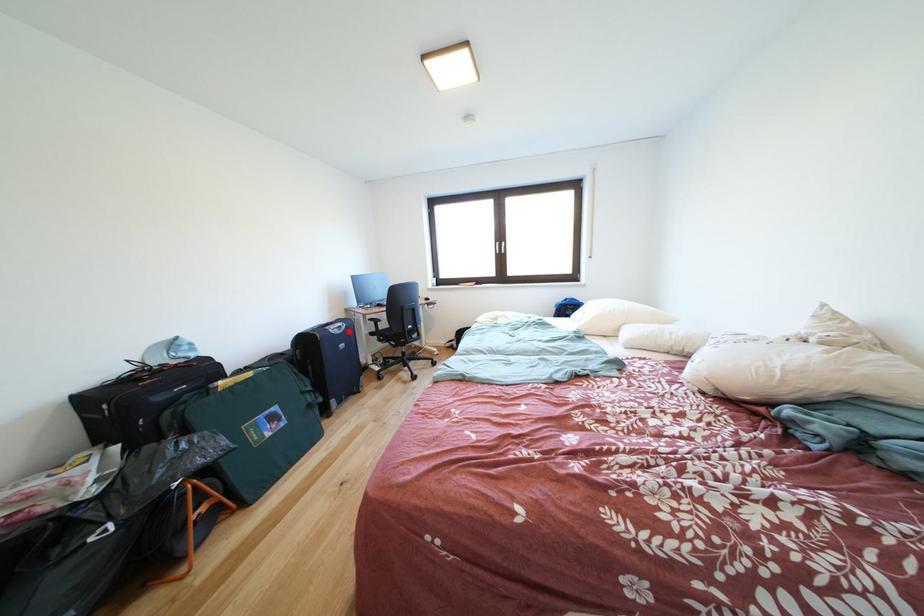
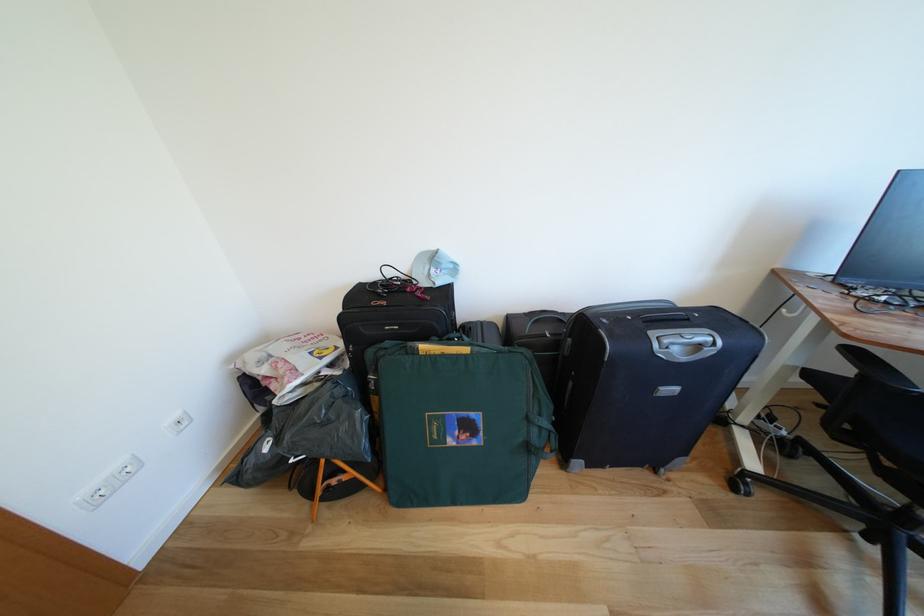
The point at the highlighted location is marked in the first image. Where is the corresponding point in the second image?

(707, 351)